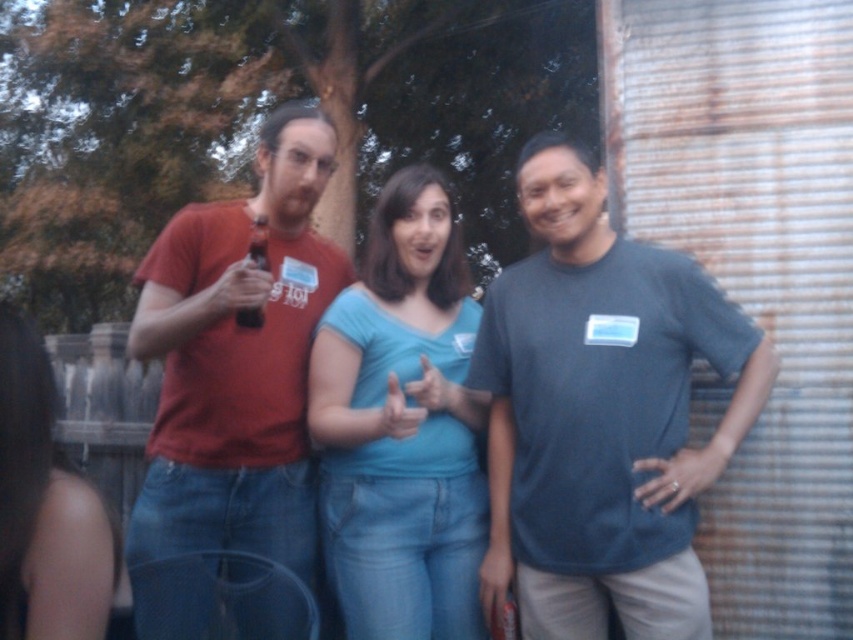
Question: Among these objects, which one is nearest to the camera?

Choices:
 (A) blue cotton shirt at center
 (B) matte plastic bottle at center

Answer: (A)

Question: Estimate the real-world distances between objects in this image. Which object is farther from the matte plastic bottle at center?

Choices:
 (A) matte red shirt at left
 (B) blue cotton shirt at center
 (C) dark gray t-shirt at center

Answer: (C)

Question: Does dark gray t-shirt at center come in front of matte plastic bottle at center?

Choices:
 (A) yes
 (B) no

Answer: (A)

Question: Observing the image, what is the correct spatial positioning of matte red shirt at left in reference to matte plastic bottle at center?

Choices:
 (A) left
 (B) right

Answer: (A)

Question: Is dark gray t-shirt at center above blue cotton shirt at center?

Choices:
 (A) no
 (B) yes

Answer: (B)

Question: Which point is closer to the camera?

Choices:
 (A) (273, 538)
 (B) (451, 573)

Answer: (B)